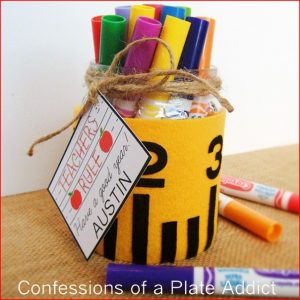
Identify the location of bucket. (178, 160).